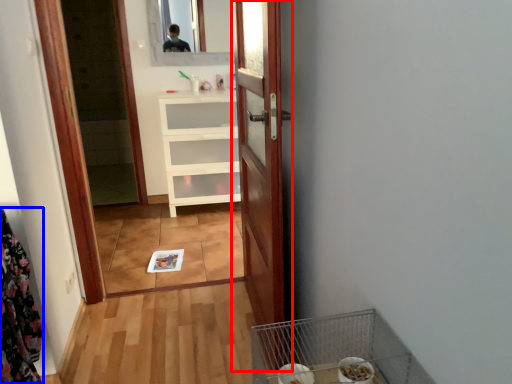
Question: Which point is further to the camera, door (highlighted by a red box) or laundry (highlighted by a blue box)?

Choices:
 (A) door
 (B) laundry

Answer: (A)